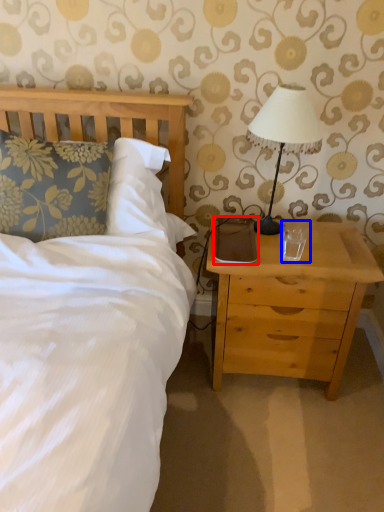
Question: Which object is closer to the camera taking this photo, pad (highlighted by a red box) or coffee cup (highlighted by a blue box)?

Choices:
 (A) pad
 (B) coffee cup

Answer: (B)